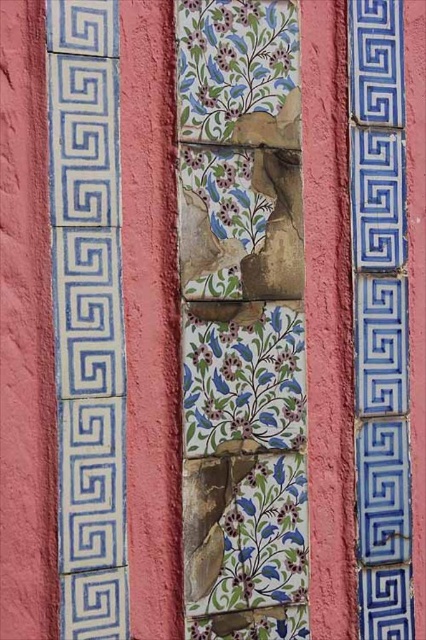
You are an interior designer assessing a wall with floral painted tiles at center and blue glossy tile at left. You need to install a shelf that requires a 4 inch gap between the shelf and the nearest tile. Can the shelf be placed between them?

The floral painted tiles at center is 3.17 inches from blue glossy tile at left. Since the required gap for the shelf is 4 inches, which is larger than the existing 3.17 inches between them, the shelf cannot be placed between them.